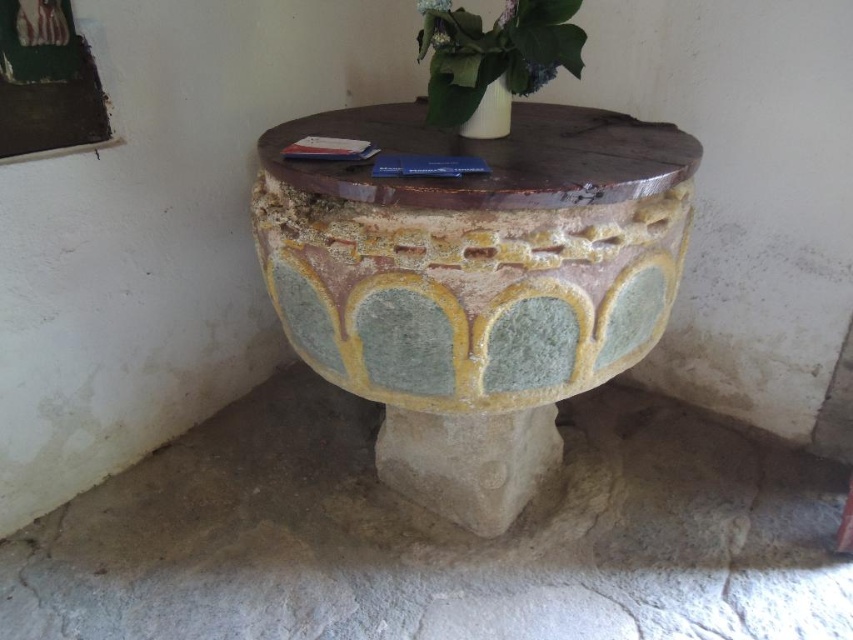
You are organizing a small event and need to place a decorative item on the speckled stone table at center. The item you have is wider than the white glossy vase at upper center. Will it fit on the table?

The speckled stone table at center is wider than the white glossy vase at upper center. Since your item is wider than the vase, it should fit on the table as long as the table can accommodate the item.

Looking at this image, you are an interior designer planning to rearrange the items in the church. You need to move the white glossy vase at upper center to a lower position. Is there enough space on the speckled stone table at center to place it without moving other items?

The speckled stone table at center is below the white glossy vase at upper center, so moving the vase to the table would require placing it on a lower surface. Since the table is already holding the vase and other items like pamphlets, there might not be enough space unless some items are rearranged.